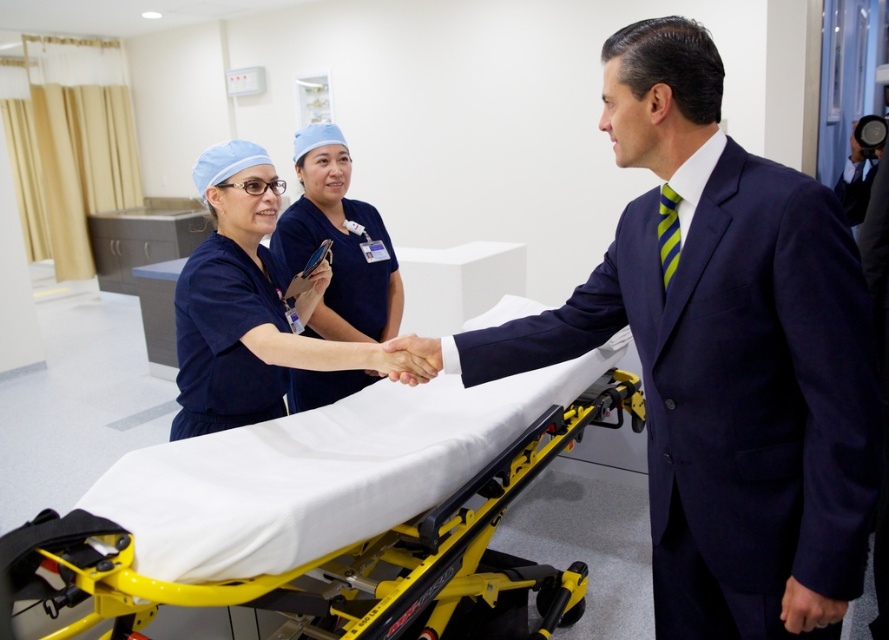
Is navy blue suit at center smaller than yellow metallic stretcher at center?

Yes.

Who is lower down, navy blue suit at center or yellow metallic stretcher at center?

yellow metallic stretcher at center is below.

This screenshot has width=889, height=640. What do you see at coordinates (721, 355) in the screenshot?
I see `navy blue suit at center` at bounding box center [721, 355].

The width and height of the screenshot is (889, 640). In order to click on navy blue suit at center in this screenshot , I will do `click(721, 355)`.

Does navy blue suit at center have a lesser width compared to blue scrubs at center?

In fact, navy blue suit at center might be wider than blue scrubs at center.

Is navy blue suit at center below blue scrubs at center?

Correct, navy blue suit at center is located below blue scrubs at center.

Is point (786, 266) farther from viewer compared to point (321, 200)?

No, (786, 266) is in front of (321, 200).

I want to click on navy blue suit at center, so click(x=721, y=355).

Can you confirm if yellow metallic stretcher at center is positioned below blue scrubs at center?

Correct, yellow metallic stretcher at center is located below blue scrubs at center.

Is yellow metallic stretcher at center closer to the viewer compared to blue scrubs at center?

Yes, it is.

Does point (306, 552) come behind point (331, 288)?

That is False.

This screenshot has width=889, height=640. Find the location of `yellow metallic stretcher at center`. yellow metallic stretcher at center is located at coordinates (583, 552).